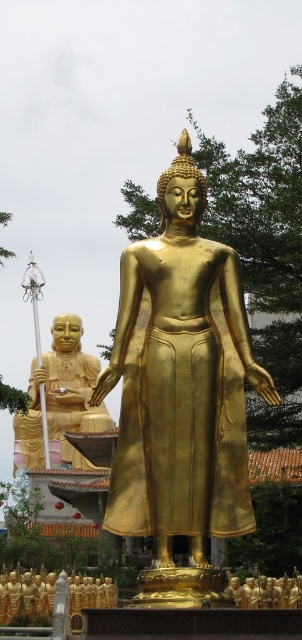
Question: Does gold polished statue at left lie in front of gold metallic statue at lower center?

Choices:
 (A) no
 (B) yes

Answer: (A)

Question: Is gold polished statue at center further to camera compared to gold polished statue at left?

Choices:
 (A) yes
 (B) no

Answer: (B)

Question: Among these objects, which one is nearest to the camera?

Choices:
 (A) gold metallic statue at lower center
 (B) gold polished statue at left

Answer: (A)

Question: Which point is farther to the camera?

Choices:
 (A) gold metallic statue at lower center
 (B) gold polished statue at left

Answer: (B)

Question: Can you confirm if gold polished statue at left is thinner than gold metallic statue at lower center?

Choices:
 (A) yes
 (B) no

Answer: (B)

Question: Which object is the closest to the gold polished statue at left?

Choices:
 (A) gold polished statue at center
 (B) gold metallic statue at lower center

Answer: (B)